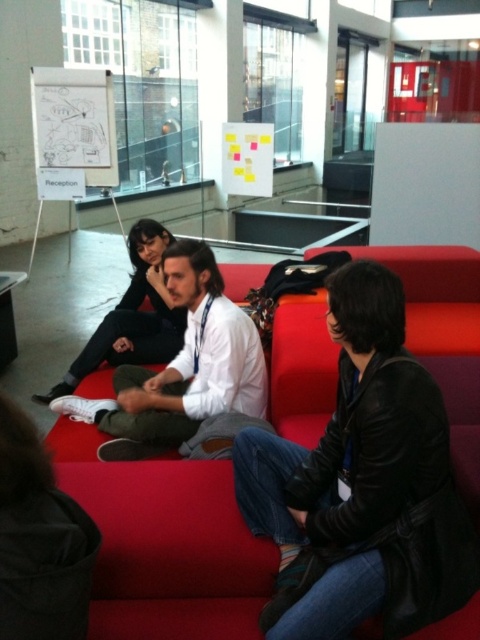
Question: Which of these objects is positioned closest to the matte black jacket at center?

Choices:
 (A) white matte shirt at center
 (B) red leather couch at center

Answer: (A)

Question: Is white matte shirt at center thinner than matte black jacket at center?

Choices:
 (A) yes
 (B) no

Answer: (B)

Question: Which of these objects is positioned closest to the matte black jacket at center?

Choices:
 (A) white matte shirt at center
 (B) red leather couch at center

Answer: (A)

Question: Considering the real-world distances, which object is farthest from the red leather couch at center?

Choices:
 (A) matte black jacket at center
 (B) white matte shirt at center

Answer: (A)

Question: Considering the relative positions of red leather couch at center and white matte shirt at center in the image provided, where is red leather couch at center located with respect to white matte shirt at center?

Choices:
 (A) left
 (B) right

Answer: (B)

Question: Is red leather couch at center smaller than matte black jacket at center?

Choices:
 (A) yes
 (B) no

Answer: (B)